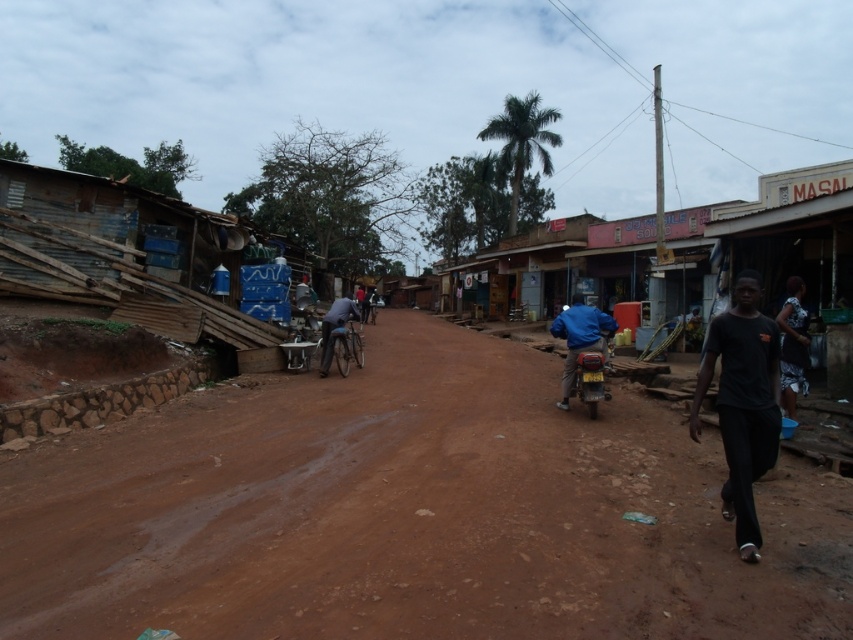
Based on the photo, can you confirm if black matte shirt at right is positioned to the left of dark gray fabric dress at lower right?

Correct, you'll find black matte shirt at right to the left of dark gray fabric dress at lower right.

Does black matte shirt at right have a greater width compared to dark gray fabric dress at lower right?

Incorrect, black matte shirt at right's width does not surpass dark gray fabric dress at lower right's.

Between point (751, 429) and point (793, 360), which one is positioned in front?

Point (751, 429) is in front.

This screenshot has height=640, width=853. What are the coordinates of `black matte shirt at right` in the screenshot? It's located at (741, 403).

Is point (805, 346) less distant than point (595, 316)?

Yes, point (805, 346) is in front of point (595, 316).

In order to click on dark gray fabric dress at lower right in this screenshot , I will do `click(793, 346)`.

Consider the image. Can you confirm if black matte shirt at right is smaller than blue fabric jacket on the right?

Correct, black matte shirt at right occupies less space than blue fabric jacket on the right.

Is point (734, 364) positioned after point (589, 323)?

No, (734, 364) is in front of (589, 323).

Measure the distance between point (x=747, y=280) and camera.

Point (x=747, y=280) is 4.26 meters away from camera.

Find the location of a particular element. black matte shirt at right is located at coordinates (741, 403).